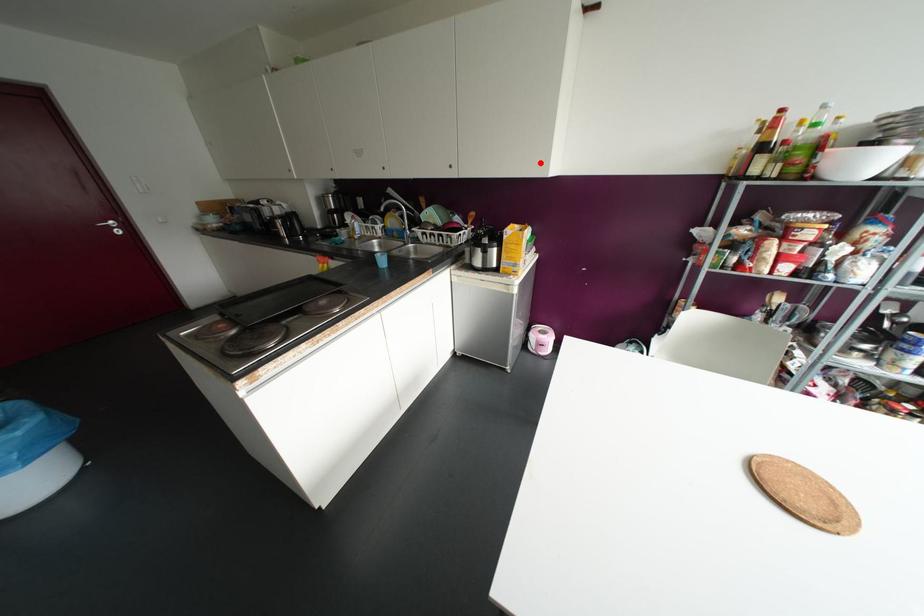
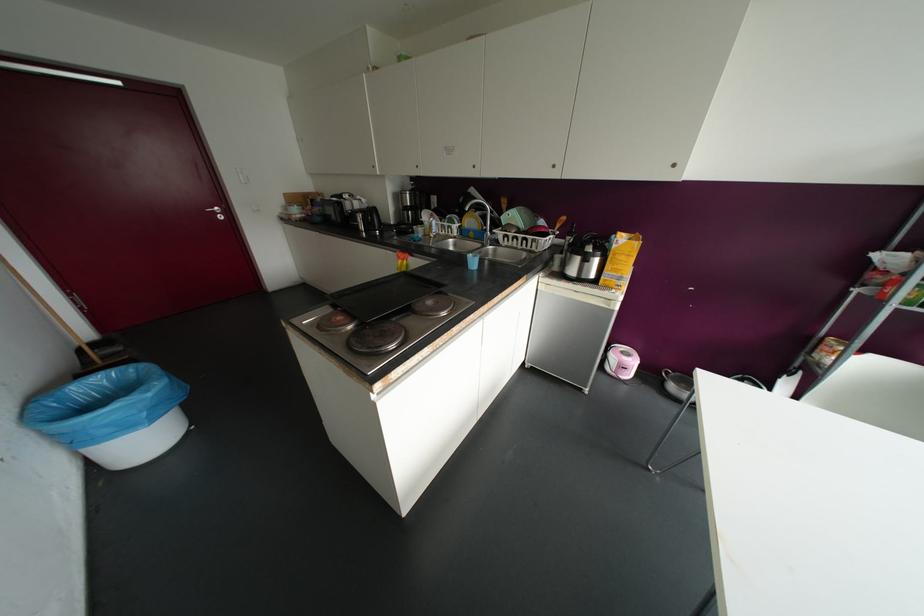
In the second image, find the point that corresponds to the highlighted location in the first image.

(673, 164)